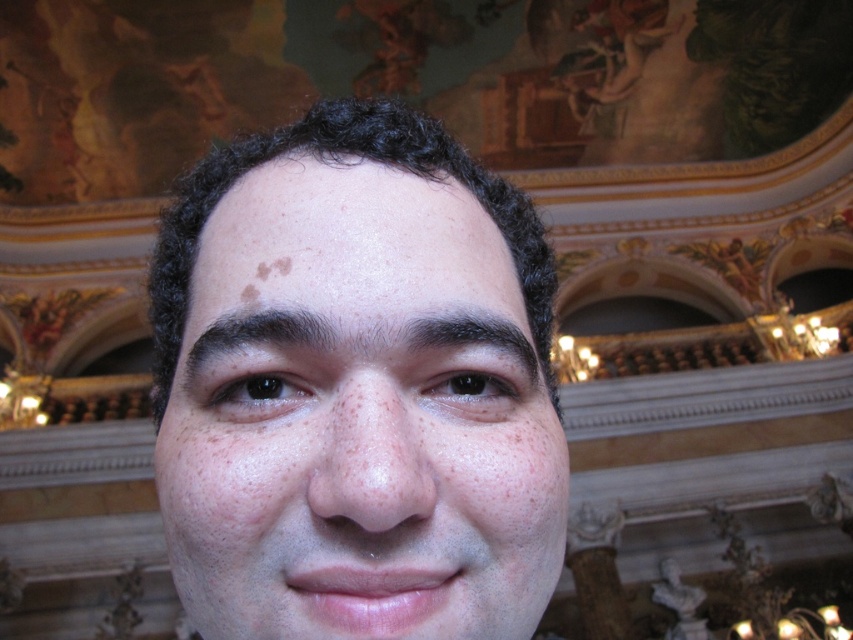
Based on the scene description, which object is positioned higher on the person depicted in the image, the smooth skin face at center or the dark brown hair at center?

The smooth skin face at center is taller than the dark brown hair at center, so the smooth skin face at center is positioned higher on the person depicted in the image.

You are standing in a grand theater with a high ornate ceiling. You notice a specific point marked at coordinates point [279,340]. If you want to reach that point with a 24 inch long pole, can you touch it without extending beyond the pole?

The distance between point [279,340] and the viewer is 25.71 inches. Since the pole is only 24 inches long, it is 1.71 inches too short to reach the point. Therefore, you cannot touch it without extending beyond the pole.

Consider the image. You are a photographer adjusting your camera settings to capture the person in the image. Since you want to focus on the smooth skin face at center, which part should you adjust your focus to ensure the dark brown hair at center is slightly out of focus?

The smooth skin face at center is closer to the viewer than the dark brown hair at center, so focusing on the smooth skin face at center will naturally leave the dark brown hair at center slightly out of focus due to the distance difference.